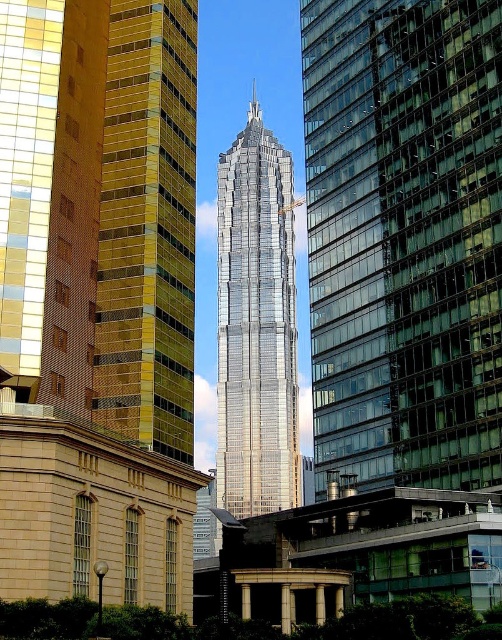
You are a city planner assessing the skyline. You notice the shiny glass skyscraper at center and the gold reflective glass tower at left. Which of these two buildings is taller?

The shiny glass skyscraper at center is much taller than the gold reflective glass tower at left according to the description.

You are an architect analyzing the urban layout of the city. You observe the shiny glass skyscraper at center and the shiny silver skyscraper at center. Which of these two buildings takes up more area in the cityscape?

The shiny silver skyscraper at center occupies more space than the shiny glass skyscraper at center according to the description.

You are a city planner assessing the skyline. You need to determine if the gold reflective glass tower at left and the shiny silver skyscraper at center are aligned vertically. Based on the scene, are they vertically aligned?

The gold reflective glass tower at left is located below the shiny silver skyscraper at center, so they are not vertically aligned.